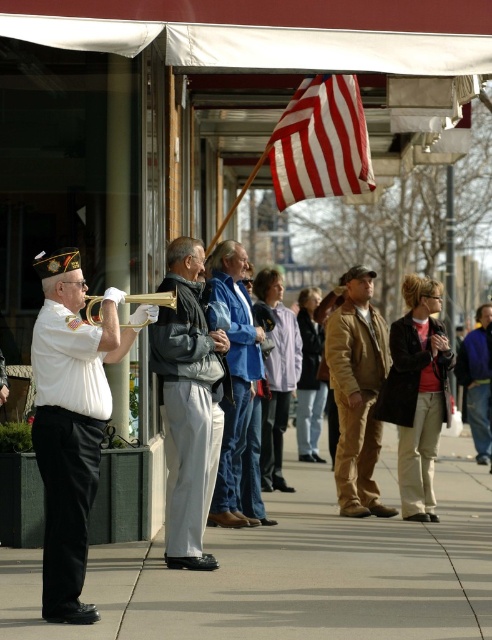
Between white matte uniform at left and brown leather jacket at center, which one has more height?

brown leather jacket at center

Is white matte uniform at left taller than brown leather jacket at center?

No.

Find the location of a particular element. This screenshot has height=640, width=492. white matte uniform at left is located at coordinates (66, 444).

Is point (161, 604) more distant than point (269, 424)?

No.

Can you confirm if gray concrete sidewalk at center is smaller than white cotton shirt at center?

Correct, gray concrete sidewalk at center occupies less space than white cotton shirt at center.

Where is `gray concrete sidewalk at center`? gray concrete sidewalk at center is located at coordinates (291, 572).

Between gray fabric jacket at center and blue fleece jacket at right, which one appears on the right side from the viewer's perspective?

blue fleece jacket at right is more to the right.

Measure the distance from gray fabric jacket at center to blue fleece jacket at right.

They are 9.47 meters apart.

Is point (165, 410) farther from viewer compared to point (487, 451)?

No, (165, 410) is in front of (487, 451).

The width and height of the screenshot is (492, 640). Identify the location of gray fabric jacket at center. (187, 404).